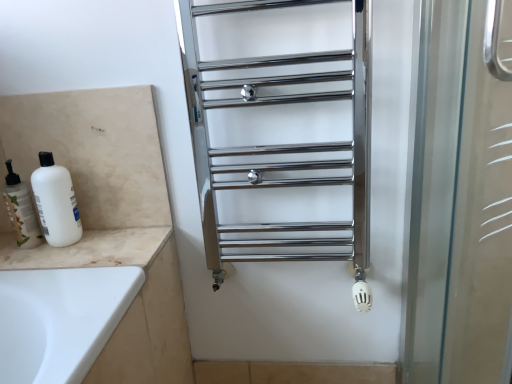
The image size is (512, 384). Find the location of `vacant space to the right of white matte bottle at left`. vacant space to the right of white matte bottle at left is located at coordinates (109, 239).